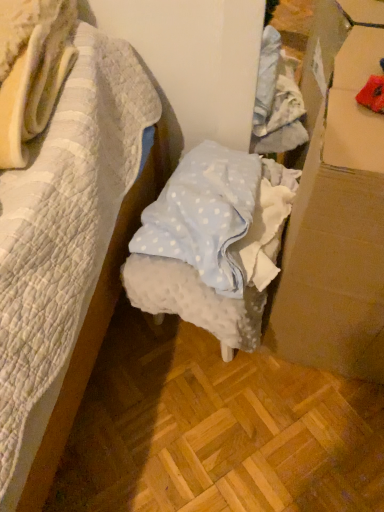
Question: In terms of size, does cardboard at right appear bigger or smaller than white dotted fabric at center?

Choices:
 (A) small
 (B) big

Answer: (B)

Question: Considering the positions of cardboard at right and white dotted fabric at center in the image, is cardboard at right taller or shorter than white dotted fabric at center?

Choices:
 (A) short
 (B) tall

Answer: (B)

Question: Does point (327, 220) appear closer or farther from the camera than point (160, 304)?

Choices:
 (A) closer
 (B) farther

Answer: (A)

Question: Is white dotted fabric at center inside the boundaries of cardboard at right, or outside?

Choices:
 (A) inside
 (B) outside

Answer: (B)

Question: In terms of size, does white dotted fabric at center appear bigger or smaller than cardboard at right?

Choices:
 (A) big
 (B) small

Answer: (B)

Question: In terms of height, does white dotted fabric at center look taller or shorter compared to cardboard at right?

Choices:
 (A) short
 (B) tall

Answer: (A)

Question: From a real-world perspective, is white dotted fabric at center physically located above or below cardboard at right?

Choices:
 (A) below
 (B) above

Answer: (A)